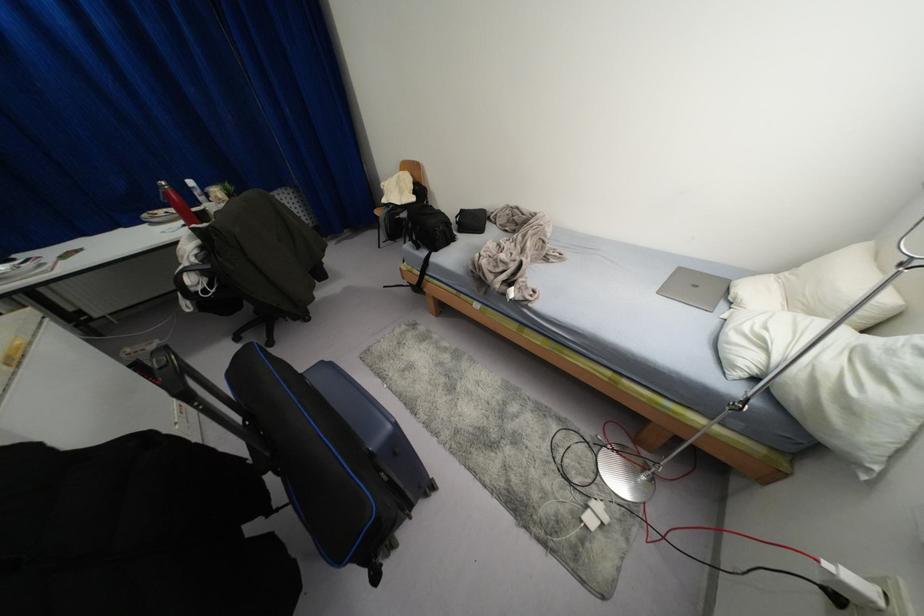
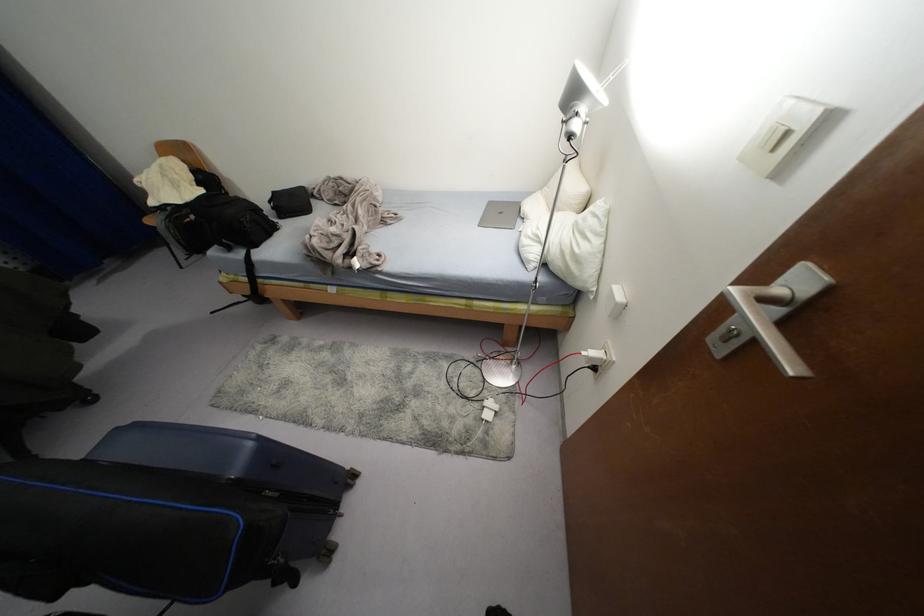
Where in the second image is the point corresponding to point 850,580 from the first image?

(592, 353)